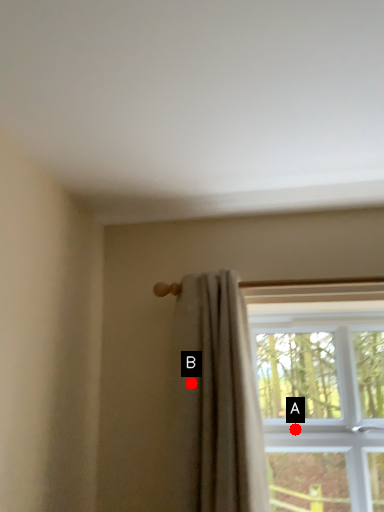
Question: Two points are circled on the image, labeled by A and B beside each circle. Which point is further to the camera?

Choices:
 (A) A is further
 (B) B is further

Answer: (A)